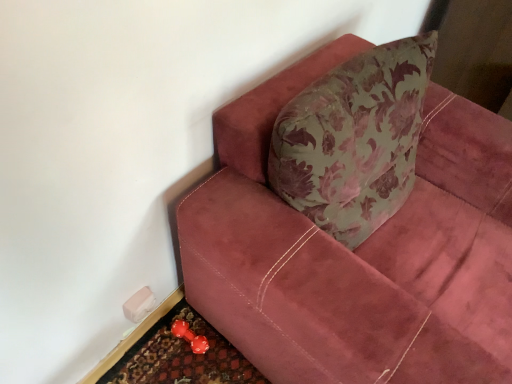
Question: Does rubberized red doormat at lower left have a lesser height compared to rubberized red dumbbell at lower left?

Choices:
 (A) yes
 (B) no

Answer: (A)

Question: Are rubberized red doormat at lower left and rubberized red dumbbell at lower left far apart?

Choices:
 (A) no
 (B) yes

Answer: (A)

Question: From a real-world perspective, does rubberized red doormat at lower left stand above rubberized red dumbbell at lower left?

Choices:
 (A) yes
 (B) no

Answer: (B)

Question: Is rubberized red doormat at lower left positioned beyond the bounds of rubberized red dumbbell at lower left?

Choices:
 (A) no
 (B) yes

Answer: (B)

Question: Can you see rubberized red doormat at lower left touching rubberized red dumbbell at lower left?

Choices:
 (A) no
 (B) yes

Answer: (B)

Question: From a real-world perspective, is rubberized red dumbbell at lower left physically located above or below rubberized red doormat at lower left?

Choices:
 (A) below
 (B) above

Answer: (B)

Question: In terms of width, does rubberized red dumbbell at lower left look wider or thinner when compared to rubberized red doormat at lower left?

Choices:
 (A) wide
 (B) thin

Answer: (B)

Question: Is rubberized red dumbbell at lower left bigger or smaller than rubberized red doormat at lower left?

Choices:
 (A) big
 (B) small

Answer: (B)

Question: Is rubberized red dumbbell at lower left in front of or behind rubberized red doormat at lower left in the image?

Choices:
 (A) behind
 (B) front

Answer: (A)

Question: In the image, is rubberized red doormat at lower left on the left side or the right side of rubberized red dumbbell at lower left?

Choices:
 (A) right
 (B) left

Answer: (A)

Question: Is rubberized red doormat at lower left taller or shorter than rubberized red dumbbell at lower left?

Choices:
 (A) short
 (B) tall

Answer: (A)

Question: Relative to rubberized red dumbbell at lower left, is rubberized red doormat at lower left in front or behind?

Choices:
 (A) front
 (B) behind

Answer: (A)

Question: Would you say rubberized red doormat at lower left is inside or outside rubberized red dumbbell at lower left?

Choices:
 (A) outside
 (B) inside

Answer: (A)

Question: From a real-world perspective, is rubberized red dumbbell at lower left above or below velvet maroon couch at upper right?

Choices:
 (A) above
 (B) below

Answer: (B)

Question: Relative to velvet maroon couch at upper right, is rubberized red dumbbell at lower left in front or behind?

Choices:
 (A) front
 (B) behind

Answer: (B)